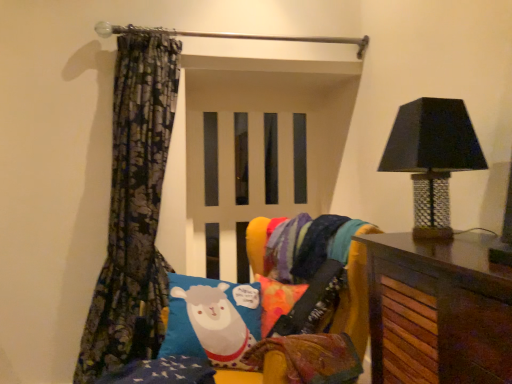
You are a GUI agent. You are given a task and a screenshot of the screen. Output one action in this format:
    pyautogui.click(x=<x>, y=<y>)
    Task: Click on the blue fabric pillow with sheep design at center
    The height and width of the screenshot is (384, 512).
    Given the screenshot: What is the action you would take?
    pyautogui.click(x=356, y=300)

Describe the element at coordinates (134, 209) in the screenshot. Image resolution: width=512 pixels, height=384 pixels. I see `floral-patterned fabric at left` at that location.

This screenshot has height=384, width=512. Describe the element at coordinates (432, 158) in the screenshot. I see `black mosaic table lamp at right` at that location.

Image resolution: width=512 pixels, height=384 pixels. I want to click on velvet multicolored bean bag chair at center, so click(x=355, y=301).

From the picture: From the image's perspective, which is below, velvet multicolored bean bag chair at center or floral-patterned fabric at left?

Answer: velvet multicolored bean bag chair at center.

Is floral-patterned fabric at left located within velvet multicolored bean bag chair at center?

No.

From a real-world perspective, is velvet multicolored bean bag chair at center located beneath floral-patterned fabric at left?

Yes.

Is velvet multicolored bean bag chair at center facing away from floral-patterned fabric at left?

No, velvet multicolored bean bag chair at center is not facing the opposite direction of floral-patterned fabric at left.

From a real-world perspective, which is physically below, blue fabric pillow with sheep design at center or floral-patterned fabric at left?

blue fabric pillow with sheep design at center.

Is blue fabric pillow with sheep design at center outside of floral-patterned fabric at left?

Indeed, blue fabric pillow with sheep design at center is completely outside floral-patterned fabric at left.

From the image's perspective, is blue fabric pillow with sheep design at center below floral-patterned fabric at left?

Yes, from the image's perspective, blue fabric pillow with sheep design at center is beneath floral-patterned fabric at left.

Identify the location of curtain lying above the blue fabric pillow with sheep design at center (from the image's perspective). (134, 209).

Is velvet multicolored bean bag chair at center shorter than blue fabric pillow with sheep design at center?

Yes.

From a real-world perspective, is velvet multicolored bean bag chair at center physically below blue fabric pillow with sheep design at center?

No, from a real-world perspective, velvet multicolored bean bag chair at center is not beneath blue fabric pillow with sheep design at center.

Would you consider velvet multicolored bean bag chair at center to be distant from blue fabric pillow with sheep design at center?

No.

Would you say velvet multicolored bean bag chair at center is inside or outside blue fabric pillow with sheep design at center?

velvet multicolored bean bag chair at center is enclosed within blue fabric pillow with sheep design at center.

In the image, there is a blue fabric pillow with sheep design at center. What are the coordinates of `curtain above it (from the image's perspective)` in the screenshot? It's located at (134, 209).

Which is more to the right, floral-patterned fabric at left or blue fabric pillow with sheep design at center?

From the viewer's perspective, blue fabric pillow with sheep design at center appears more on the right side.

Between floral-patterned fabric at left and blue fabric pillow with sheep design at center, which one has larger width?

blue fabric pillow with sheep design at center.

Consider the image. Is floral-patterned fabric at left looking in the opposite direction of blue fabric pillow with sheep design at center?

No, floral-patterned fabric at left's orientation is not away from blue fabric pillow with sheep design at center.

Could black mosaic table lamp at right be considered to be inside blue fabric pillow with sheep design at center?

No, black mosaic table lamp at right is not surrounded by blue fabric pillow with sheep design at center.

Who is taller, blue fabric pillow with sheep design at center or black mosaic table lamp at right?

blue fabric pillow with sheep design at center is taller.

From the image's perspective, is blue fabric pillow with sheep design at center positioned above or below black mosaic table lamp at right?

Based on their image positions, blue fabric pillow with sheep design at center is located beneath black mosaic table lamp at right.

Can you confirm if velvet multicolored bean bag chair at center is wider than black mosaic table lamp at right?

Indeed, velvet multicolored bean bag chair at center has a greater width compared to black mosaic table lamp at right.

From a real-world perspective, between velvet multicolored bean bag chair at center and black mosaic table lamp at right, who is vertically lower?

In real-world perspective, velvet multicolored bean bag chair at center is lower.

In the scene shown: Can you confirm if velvet multicolored bean bag chair at center is taller than black mosaic table lamp at right?

In fact, velvet multicolored bean bag chair at center may be shorter than black mosaic table lamp at right.

Which object is more forward, blue fabric pillow with sheep design at center or velvet multicolored bean bag chair at center?

blue fabric pillow with sheep design at center is closer to the camera.

Is blue fabric pillow with sheep design at center aimed at velvet multicolored bean bag chair at center?

No, blue fabric pillow with sheep design at center is not turned towards velvet multicolored bean bag chair at center.

Between blue fabric pillow with sheep design at center and velvet multicolored bean bag chair at center, which one has smaller size?

With smaller size is velvet multicolored bean bag chair at center.

Does blue fabric pillow with sheep design at center contain velvet multicolored bean bag chair at center?

Yes, velvet multicolored bean bag chair at center can be found within blue fabric pillow with sheep design at center.

Locate an element on the screen. Image resolution: width=512 pixels, height=384 pixels. bean bag chair in front of the floral-patterned fabric at left is located at coordinates (355, 301).

Where is `curtain behind the blue fabric pillow with sheep design at center`? curtain behind the blue fabric pillow with sheep design at center is located at coordinates (134, 209).

Looking at the image, which one is located further to blue fabric pillow with sheep design at center, black mosaic table lamp at right or velvet multicolored bean bag chair at center?

Among the two, black mosaic table lamp at right is located further to blue fabric pillow with sheep design at center.

From the image, which object appears to be farther from floral-patterned fabric at left, black mosaic table lamp at right or velvet multicolored bean bag chair at center?

Among the two, black mosaic table lamp at right is located further to floral-patterned fabric at left.

Estimate the real-world distances between objects in this image. Which object is further from floral-patterned fabric at left, blue fabric pillow with sheep design at center or velvet multicolored bean bag chair at center?

Based on the image, blue fabric pillow with sheep design at center appears to be further to floral-patterned fabric at left.

Based on their spatial positions, is black mosaic table lamp at right or blue fabric pillow with sheep design at center further from floral-patterned fabric at left?

black mosaic table lamp at right is positioned further to the anchor floral-patterned fabric at left.

When comparing their distances from floral-patterned fabric at left, does velvet multicolored bean bag chair at center or blue fabric pillow with sheep design at center seem closer?

Among the two, velvet multicolored bean bag chair at center is located nearer to floral-patterned fabric at left.

Looking at the image, which one is located further to blue fabric pillow with sheep design at center, floral-patterned fabric at left or black mosaic table lamp at right?

floral-patterned fabric at left is further to blue fabric pillow with sheep design at center.

When comparing their distances from black mosaic table lamp at right, does blue fabric pillow with sheep design at center or velvet multicolored bean bag chair at center seem further?

Among the two, blue fabric pillow with sheep design at center is located further to black mosaic table lamp at right.

Based on their spatial positions, is floral-patterned fabric at left or velvet multicolored bean bag chair at center closer to blue fabric pillow with sheep design at center?

Among the two, velvet multicolored bean bag chair at center is located nearer to blue fabric pillow with sheep design at center.

Find the location of a particular element. The image size is (512, 384). furniture between floral-patterned fabric at left and velvet multicolored bean bag chair at center is located at coordinates (356, 300).

Locate an element on the screen. bean bag chair between black mosaic table lamp at right and blue fabric pillow with sheep design at center vertically is located at coordinates (355, 301).

Identify the location of furniture between floral-patterned fabric at left and black mosaic table lamp at right. (356, 300).

Where is `bean bag chair between floral-patterned fabric at left and black mosaic table lamp at right in the horizontal direction`? bean bag chair between floral-patterned fabric at left and black mosaic table lamp at right in the horizontal direction is located at coordinates (355, 301).